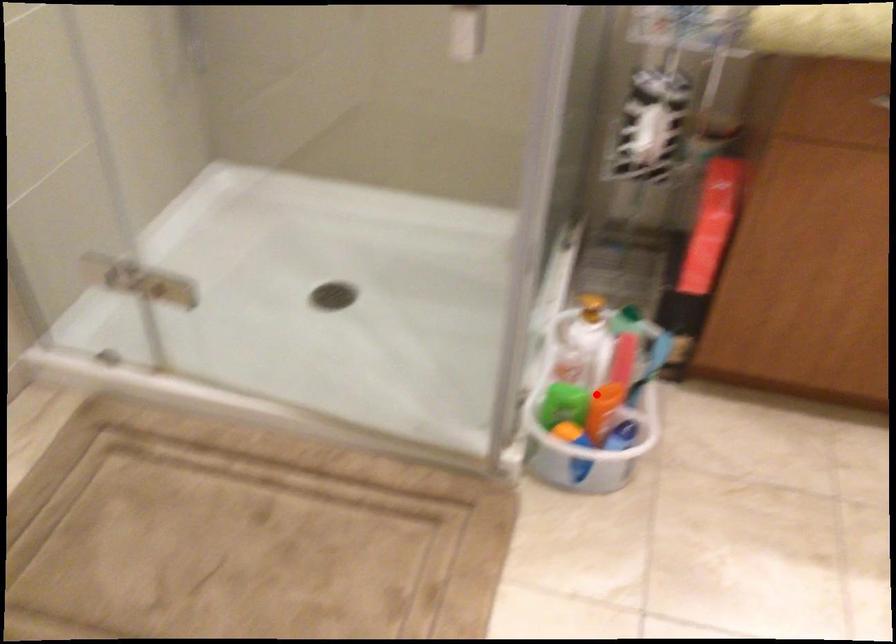
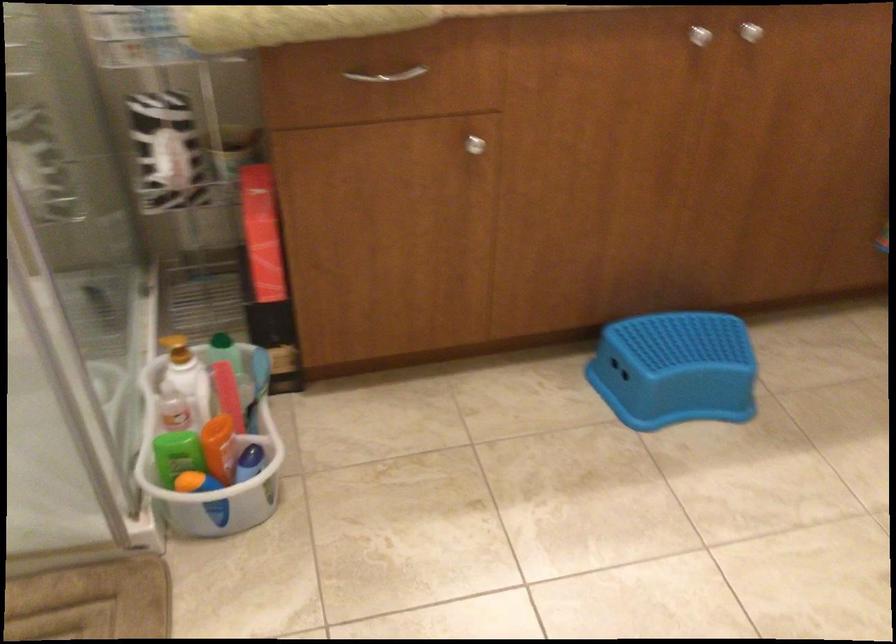
The point at the highlighted location is marked in the first image. Where is the corresponding point in the second image?

(208, 439)